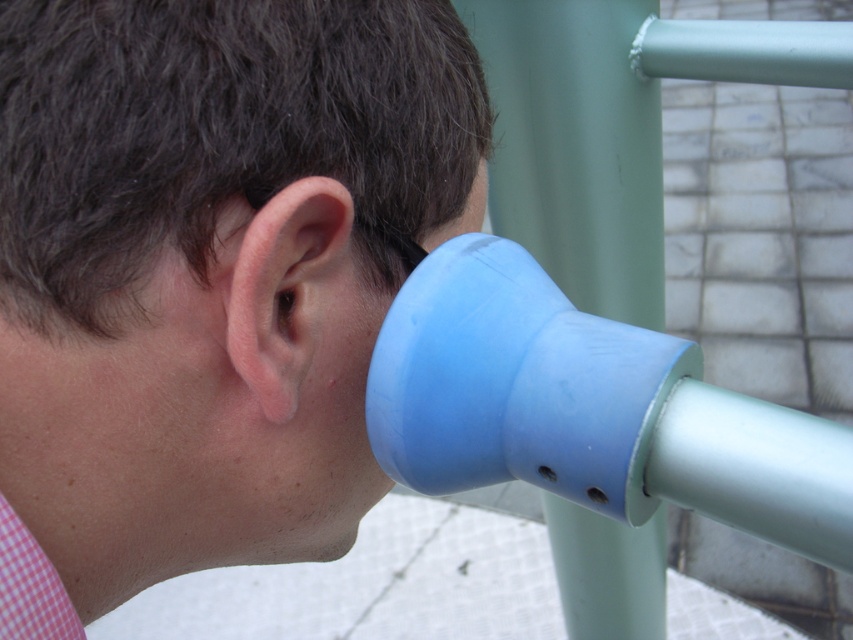
You are a delivery robot in a park. You need to place a package on the blue rubber cup at right. Where should you place it?

You should place the package at point (212,269) where the blue rubber cup at right is located.